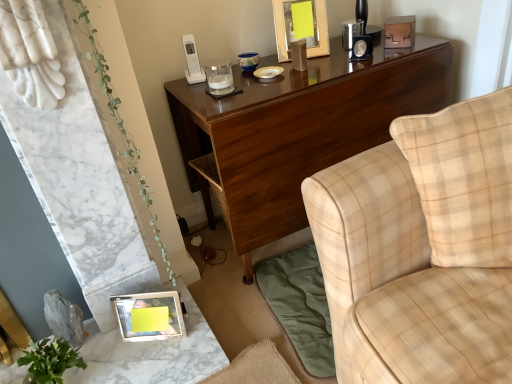
This screenshot has width=512, height=384. What do you see at coordinates (149, 316) in the screenshot?
I see `metallic silver photo frame at lower left, the 1th picture frame viewed from the front` at bounding box center [149, 316].

Where is `glossy wood desk at upper center`? This screenshot has height=384, width=512. glossy wood desk at upper center is located at coordinates (298, 130).

Image resolution: width=512 pixels, height=384 pixels. Describe the element at coordinates (422, 249) in the screenshot. I see `beige plaid fabric couch at upper right` at that location.

Where is `beige plaid pillow at right`? This screenshot has width=512, height=384. beige plaid pillow at right is located at coordinates (464, 178).

You are a GUI agent. You are given a task and a screenshot of the screen. Output one action in this format:
    pyautogui.click(x=<x>, y=<y>)
    Task: Click on the metallic silver photo frame at lower left, the first picture frame viewed from the left
    This screenshot has width=512, height=384.
    Given the screenshot: What is the action you would take?
    pyautogui.click(x=149, y=316)

Is green leafy plant at lower left closer to the viewer compared to glossy wood desk at upper center?

Yes, green leafy plant at lower left is closer to the viewer.

Between green leafy plant at lower left and glossy wood desk at upper center, which one appears on the left side from the viewer's perspective?

green leafy plant at lower left.

Is green leafy plant at lower left wider or thinner than glossy wood desk at upper center?

In the image, green leafy plant at lower left appears to be more narrow than glossy wood desk at upper center.

Is green leafy plant at lower left inside the boundaries of glossy wood desk at upper center, or outside?

green leafy plant at lower left is spatially situated outside glossy wood desk at upper center.

Based on the photo, considering the relative sizes of metallic silver frame at lower left and beige plaid pillow at right in the image provided, is metallic silver frame at lower left bigger than beige plaid pillow at right?

Actually, metallic silver frame at lower left might be smaller than beige plaid pillow at right.

Is metallic silver frame at lower left facing away from beige plaid pillow at right?

No, metallic silver frame at lower left's orientation is not away from beige plaid pillow at right.

Would you consider metallic silver frame at lower left to be distant from beige plaid pillow at right?

No, metallic silver frame at lower left is not far away from beige plaid pillow at right.

From the image's perspective, is metallic silver frame at lower left above or below beige plaid pillow at right?

From the image's perspective, metallic silver frame at lower left appears below beige plaid pillow at right.

Does metallic silver photo frame at lower left, acting as the 2th picture frame starting from the back, have a greater height compared to beige plaid fabric couch at upper right?

Incorrect, the height of metallic silver photo frame at lower left, acting as the 2th picture frame starting from the back, is not larger of that of beige plaid fabric couch at upper right.

Can you confirm if metallic silver photo frame at lower left, the first picture frame viewed from the left, is bigger than beige plaid fabric couch at upper right?

No, metallic silver photo frame at lower left, the first picture frame viewed from the left, is not bigger than beige plaid fabric couch at upper right.

Does point (181, 306) lie in front of point (480, 219)?

No, (181, 306) is further to viewer.

From the picture: Is yellow paper at upper center, which is the first picture frame in top-to-bottom order, completely or partially outside of beige plaid pillow at right?

yellow paper at upper center, which is the first picture frame in top-to-bottom order, is positioned outside beige plaid pillow at right.

Which object is positioned more to the left, yellow paper at upper center, which is the first picture frame in top-to-bottom order, or beige plaid pillow at right?

yellow paper at upper center, which is the first picture frame in top-to-bottom order, is more to the left.

Is yellow paper at upper center, the first picture frame from the right, far from beige plaid pillow at right?

yellow paper at upper center, the first picture frame from the right, is actually quite close to beige plaid pillow at right.

In the scene shown: Is glossy wood desk at upper center next to metallic silver photo frame at lower left, the 1th picture frame viewed from the front, and touching it?

They are not placed beside each other.

Considering the sizes of objects glossy wood desk at upper center and metallic silver photo frame at lower left, acting as the first picture frame starting from the bottom, in the image provided, who is thinner, glossy wood desk at upper center or metallic silver photo frame at lower left, acting as the first picture frame starting from the bottom,?

metallic silver photo frame at lower left, acting as the first picture frame starting from the bottom, is thinner.

From a real-world perspective, between glossy wood desk at upper center and metallic silver photo frame at lower left, the 1th picture frame viewed from the front, who is vertically higher?

glossy wood desk at upper center.

How different are the orientations of metallic silver frame at lower left and metallic silver photo frame at lower left, the 1th picture frame viewed from the front, in degrees?

Answer: The angle between the facing direction of metallic silver frame at lower left and the facing direction of metallic silver photo frame at lower left, the 1th picture frame viewed from the front, is 26.2 degrees.

Could you tell me if metallic silver frame at lower left is facing metallic silver photo frame at lower left, acting as the first picture frame starting from the bottom?

No, metallic silver frame at lower left is not facing towards metallic silver photo frame at lower left, acting as the first picture frame starting from the bottom.

Considering the positions of objects metallic silver frame at lower left and metallic silver photo frame at lower left, acting as the 2th picture frame starting from the back, in the image provided, who is behind, metallic silver frame at lower left or metallic silver photo frame at lower left, acting as the 2th picture frame starting from the back,?

metallic silver photo frame at lower left, acting as the 2th picture frame starting from the back, is behind.

Is metallic silver frame at lower left not close to metallic silver photo frame at lower left, acting as the 2th picture frame starting from the back?

No, metallic silver frame at lower left is not far away from metallic silver photo frame at lower left, acting as the 2th picture frame starting from the back.

Does beige plaid pillow at right appear on the right side of green leafy plant at lower left?

Correct, you'll find beige plaid pillow at right to the right of green leafy plant at lower left.

Is beige plaid pillow at right positioned far away from green leafy plant at lower left?

No, beige plaid pillow at right is in close proximity to green leafy plant at lower left.

The image size is (512, 384). Identify the location of pillow that appears in front of the green leafy plant at lower left. (464, 178).

Is green leafy plant at lower left surrounded by beige plaid pillow at right?

No, green leafy plant at lower left is not a part of beige plaid pillow at right.

This screenshot has height=384, width=512. Identify the location of desk that appears on the right of green leafy plant at lower left. (298, 130).

I want to click on counter top on the left side of beige plaid pillow at right, so click(151, 354).

Considering their positions, is metallic silver photo frame at lower left, acting as the 2th picture frame starting from the back, positioned closer to yellow paper at upper center, the first picture frame from the right, than beige plaid fabric couch at upper right?

Among the two, beige plaid fabric couch at upper right is located nearer to yellow paper at upper center, the first picture frame from the right.

Based on their spatial positions, is yellow paper at upper center, positioned as the 2th picture frame in bottom-to-top order, or beige plaid pillow at right further from glossy wood desk at upper center?

The object further to glossy wood desk at upper center is beige plaid pillow at right.

Looking at the image, which one is located closer to beige plaid fabric couch at upper right, glossy wood desk at upper center or yellow paper at upper center, the first picture frame from the right?

glossy wood desk at upper center is closer to beige plaid fabric couch at upper right.

Considering their positions, is yellow paper at upper center, the first picture frame from the back, positioned further to metallic silver photo frame at lower left, acting as the first picture frame starting from the bottom, than beige plaid pillow at right?

yellow paper at upper center, the first picture frame from the back, is positioned further to the anchor metallic silver photo frame at lower left, acting as the first picture frame starting from the bottom.

Based on their spatial positions, is beige plaid fabric couch at upper right or beige plaid pillow at right closer to glossy wood desk at upper center?

beige plaid fabric couch at upper right.

Based on their spatial positions, is beige plaid fabric couch at upper right or metallic silver frame at lower left further from metallic silver photo frame at lower left, acting as the first picture frame starting from the bottom?

beige plaid fabric couch at upper right lies further to metallic silver photo frame at lower left, acting as the first picture frame starting from the bottom, than the other object.

Looking at the image, which one is located closer to yellow paper at upper center, the first picture frame from the right, beige plaid fabric couch at upper right or metallic silver frame at lower left?

beige plaid fabric couch at upper right lies closer to yellow paper at upper center, the first picture frame from the right, than the other object.

From the image, which object appears to be nearer to yellow paper at upper center, the first picture frame from the right, glossy wood desk at upper center or green leafy plant at lower left?

glossy wood desk at upper center lies closer to yellow paper at upper center, the first picture frame from the right, than the other object.

Identify the location of desk located between beige plaid fabric couch at upper right and metallic silver photo frame at lower left, which ranks as the 2th picture frame in right-to-left order, in the depth direction. (298, 130).

I want to click on pillow located between metallic silver frame at lower left and beige plaid fabric couch at upper right in the left-right direction, so click(464, 178).

In order to click on desk between beige plaid pillow at right and yellow paper at upper center, arranged as the second picture frame when viewed from the left, in the front-back direction in this screenshot , I will do `click(298, 130)`.

This screenshot has height=384, width=512. In order to click on desk positioned between beige plaid fabric couch at upper right and yellow paper at upper center, the first picture frame from the right, from near to far in this screenshot , I will do `click(298, 130)`.